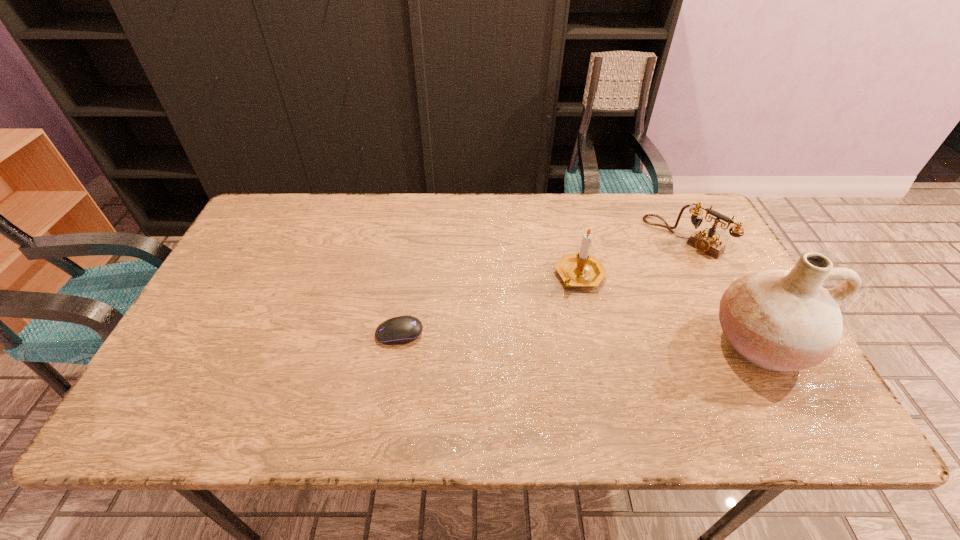
Locate an element on the screen. The width and height of the screenshot is (960, 540). vacant space on the desktop that is between the shortest object and the tallest object and is positioned on the front-facing side of the telephone is located at coordinates (562, 338).

Find the location of `free spot on the desktop that is between the leftmost object and the pottery and is positioned with a handle on the second tallest object`. free spot on the desktop that is between the leftmost object and the pottery and is positioned with a handle on the second tallest object is located at coordinates (571, 338).